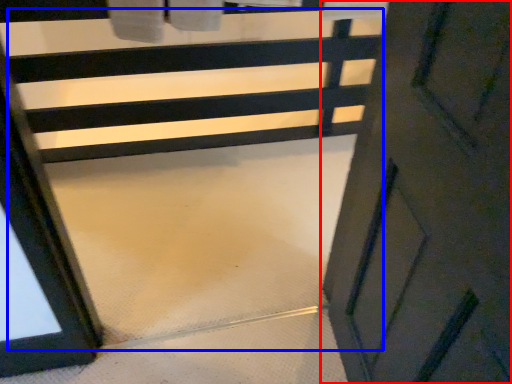
Question: Which of the following is the closest to the observer, door (highlighted by a red box) or stair (highlighted by a blue box)?

Choices:
 (A) door
 (B) stair

Answer: (A)